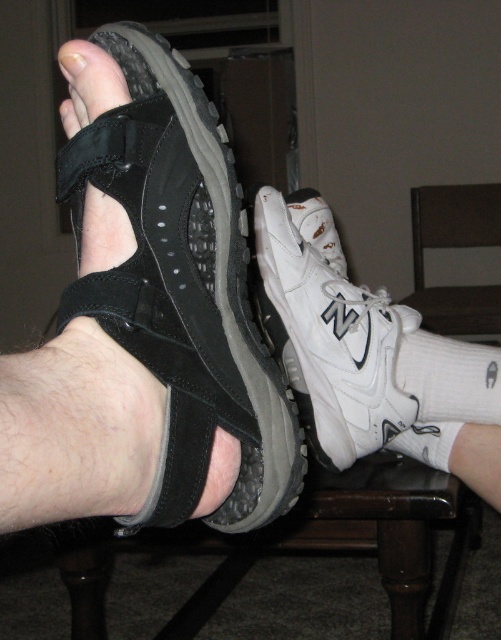
Which is more to the left, white mesh shoe at center or white matte nail at center?

white matte nail at center

Who is lower down, white mesh shoe at center or white matte nail at center?

→ white mesh shoe at center

Is point (389, 403) in front of point (79, 72)?

That is False.

Locate an element on the screen. This screenshot has width=501, height=640. white mesh shoe at center is located at coordinates (327, 330).

Who is higher up, black suede sandal at left or white fabric at center?

black suede sandal at left

Is black suede sandal at left closer to camera compared to white fabric at center?

Yes, black suede sandal at left is in front of white fabric at center.

Which is behind, point (116, 140) or point (438, 435)?

Point (438, 435)

Locate an element on the screen. black suede sandal at left is located at coordinates (182, 285).

Between white fabric at center and white matte nail at center, which one is positioned lower?

white fabric at center

Between white fabric at center and white matte nail at center, which one has more height?

Standing taller between the two is white matte nail at center.

Locate an element on the screen. The image size is (501, 640). white fabric at center is located at coordinates (426, 442).

You are a GUI agent. You are given a task and a screenshot of the screen. Output one action in this format:
    pyautogui.click(x=<x>, y=<y>)
    Task: Click on the white fabric at center
    The image size is (501, 640).
    Given the screenshot: What is the action you would take?
    pyautogui.click(x=426, y=442)